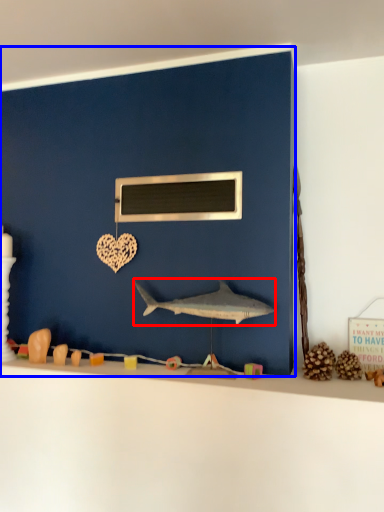
Question: Which point is further to the camera, shark (highlighted by a red box) or backdrop (highlighted by a blue box)?

Choices:
 (A) shark
 (B) backdrop

Answer: (B)